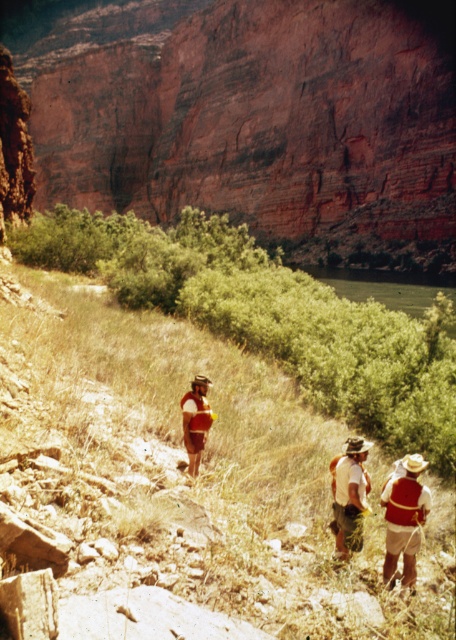
Question: Considering the real-world distances, which object is closest to the white fabric shirt at lower center?

Choices:
 (A) matte red backpack at center
 (B) matte red vest at center

Answer: (B)

Question: Is matte red vest at center to the left of matte red backpack at center from the viewer's perspective?

Choices:
 (A) yes
 (B) no

Answer: (B)

Question: Can you confirm if matte red vest at center is positioned below white fabric shirt at lower center?

Choices:
 (A) no
 (B) yes

Answer: (B)

Question: Which of these objects is positioned closest to the white fabric shirt at lower center?

Choices:
 (A) matte red vest at center
 (B) matte red backpack at center

Answer: (A)

Question: Can you confirm if white fabric shirt at lower center is positioned above matte red backpack at center?

Choices:
 (A) yes
 (B) no

Answer: (B)

Question: Which object appears farthest from the camera in this image?

Choices:
 (A) white fabric shirt at lower center
 (B) matte red vest at center
 (C) matte red backpack at center

Answer: (C)